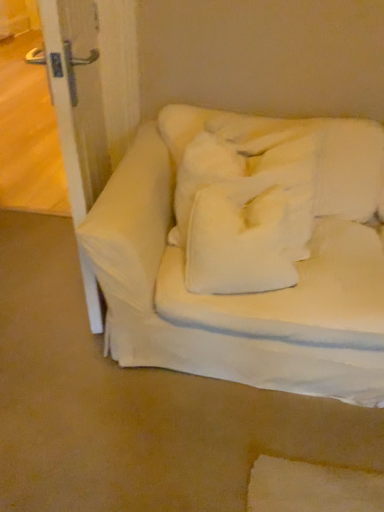
Describe the element at coordinates (247, 252) in the screenshot. I see `white fabric couch at center` at that location.

Looking at this image, in order to face white soft pillow at center, should I rotate leftwards or rightwards?

Turn right by 7.206 degrees to look at white soft pillow at center.

Identify the location of white fabric couch at center. (247, 252).

Is white soft pillow at center taller or shorter than white soft pillow at center?

Considering their sizes, white soft pillow at center has more height than white soft pillow at center.

Which point is more forward, (365,168) or (251,277)?

Positioned in front is point (251,277).

From the image's perspective, is white soft pillow at center above or below white soft pillow at center?

From the image's perspective, white soft pillow at center appears above white soft pillow at center.

I want to click on pillow that appears below the white fabric couch at center (from the image's perspective), so click(x=247, y=240).

From the image's perspective, is white soft pillow at center above white fabric couch at center?

Incorrect, from the image's perspective, white soft pillow at center is lower than white fabric couch at center.

Is point (230, 282) closer to viewer compared to point (167, 342)?

Yes.

Between white soft pillow at center and white fabric couch at center, which one has smaller width?

Thinner between the two is white soft pillow at center.

Can you confirm if white fabric couch at center is positioned to the right of white soft pillow at center?

Correct, you'll find white fabric couch at center to the right of white soft pillow at center.

Is white fabric couch at center positioned with its back to white soft pillow at center?

Yes, white fabric couch at center is facing away from white soft pillow at center.

Looking at this image, considering the sizes of white fabric couch at center and white soft pillow at center in the image, is white fabric couch at center taller or shorter than white soft pillow at center?

white fabric couch at center is taller than white soft pillow at center.

Which is behind, white fabric couch at center or white soft pillow at center?

white soft pillow at center is further away from the camera.

How different are the orientations of white soft pillow at center and white soft pillow at center in degrees?

They differ by 0.00115 degrees in their facing directions.

Between white soft pillow at center and white soft pillow at center, which one has less height?

Standing shorter between the two is white soft pillow at center.

The image size is (384, 512). Find the location of `pillow directly beneath the white soft pillow at center (from a real-world perspective)`. pillow directly beneath the white soft pillow at center (from a real-world perspective) is located at coordinates (247, 240).

From the image's perspective, relative to white soft pillow at center, is white soft pillow at center above or below?

white soft pillow at center is situated lower than white soft pillow at center in the image.

Is white soft pillow at center turned away from white fabric couch at center?

Correct, white soft pillow at center is looking away from white fabric couch at center.

Is white soft pillow at center shorter than white fabric couch at center?

Yes.

Is white soft pillow at center behind white fabric couch at center?

Yes, it is behind white fabric couch at center.

From a real-world perspective, is white soft pillow at center positioned above or below white fabric couch at center?

white soft pillow at center is above white fabric couch at center.

Which is in front, white fabric couch at center or white soft pillow at center?

white fabric couch at center is in front.

From the image's perspective, relative to white soft pillow at center, is white fabric couch at center above or below?

From the image's perspective, white fabric couch at center appears below white soft pillow at center.

This screenshot has height=512, width=384. I want to click on bedding above the white soft pillow at center (from the image's perspective), so click(x=264, y=191).

At what (x,y) coordinates should I click in order to perform the action: click on furniture lying in front of the white soft pillow at center. Please return your answer as a coordinate pair (x, y). Looking at the image, I should click on (247, 252).

Estimate the real-world distances between objects in this image. Which object is closer to white fabric couch at center, white soft pillow at center or white soft pillow at center?

Among the two, white soft pillow at center is located nearer to white fabric couch at center.

From the image, which object appears to be nearer to white fabric couch at center, white soft pillow at center or white soft pillow at center?

white soft pillow at center is positioned closer to the anchor white fabric couch at center.

Estimate the real-world distances between objects in this image. Which object is closer to white soft pillow at center, white fabric couch at center or white soft pillow at center?

Among the two, white soft pillow at center is located nearer to white soft pillow at center.

Considering their positions, is white fabric couch at center positioned closer to white soft pillow at center than white soft pillow at center?

white soft pillow at center is positioned closer to the anchor white soft pillow at center.

Which object lies nearer to the anchor point white soft pillow at center, white soft pillow at center or white fabric couch at center?

white soft pillow at center is positioned closer to the anchor white soft pillow at center.

From the image, which object appears to be nearer to white soft pillow at center, white soft pillow at center or white fabric couch at center?

white soft pillow at center lies closer to white soft pillow at center than the other object.

Locate an element on the screen. This screenshot has height=512, width=384. pillow located between white fabric couch at center and white soft pillow at center in the depth direction is located at coordinates (247, 240).